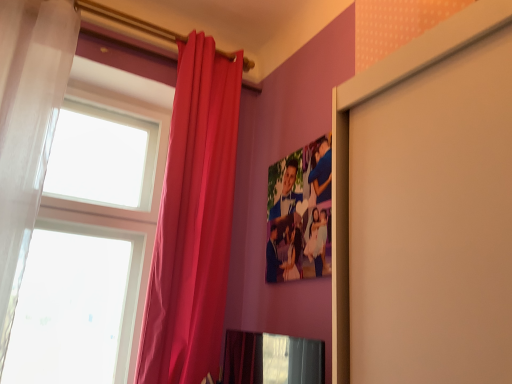
Question: Are sheer white curtain at left, arranged as the 2th curtain when viewed from the right, and matte pink curtain at upper left, which is the first curtain from right to left, far apart?

Choices:
 (A) yes
 (B) no

Answer: (B)

Question: From a real-world perspective, does sheer white curtain at left, which ranks as the 1th curtain in left-to-right order, stand above matte pink curtain at upper left, which is the first curtain from right to left?

Choices:
 (A) yes
 (B) no

Answer: (A)

Question: Would you say sheer white curtain at left, arranged as the 2th curtain when viewed from the right, is outside matte pink curtain at upper left, which is the first curtain from right to left?

Choices:
 (A) yes
 (B) no

Answer: (A)

Question: Is the surface of sheer white curtain at left, which ranks as the 1th curtain in left-to-right order, in direct contact with matte pink curtain at upper left, which is the first curtain from right to left?

Choices:
 (A) yes
 (B) no

Answer: (B)

Question: Is sheer white curtain at left, arranged as the 2th curtain when viewed from the right, further to camera compared to matte pink curtain at upper left, which ranks as the 2th curtain in left-to-right order?

Choices:
 (A) yes
 (B) no

Answer: (B)

Question: From the image's perspective, is sheer white curtain at left, arranged as the 2th curtain when viewed from the right, on matte pink curtain at upper left, which ranks as the 2th curtain in left-to-right order?

Choices:
 (A) yes
 (B) no

Answer: (A)

Question: Can you confirm if matte pink curtain at upper left, which ranks as the 2th curtain in left-to-right order, is positioned to the left of sheer white curtain at left, which ranks as the 1th curtain in left-to-right order?

Choices:
 (A) no
 (B) yes

Answer: (A)

Question: Considering the relative sizes of matte pink curtain at upper left, which is the first curtain from right to left, and sheer white curtain at left, which ranks as the 1th curtain in left-to-right order, in the image provided, is matte pink curtain at upper left, which is the first curtain from right to left, smaller than sheer white curtain at left, which ranks as the 1th curtain in left-to-right order,?

Choices:
 (A) yes
 (B) no

Answer: (B)

Question: Is matte pink curtain at upper left, which is the first curtain from right to left, turned away from sheer white curtain at left, which ranks as the 1th curtain in left-to-right order?

Choices:
 (A) yes
 (B) no

Answer: (B)

Question: From the image's perspective, is matte pink curtain at upper left, which ranks as the 2th curtain in left-to-right order, under sheer white curtain at left, arranged as the 2th curtain when viewed from the right?

Choices:
 (A) yes
 (B) no

Answer: (A)

Question: Does matte pink curtain at upper left, which ranks as the 2th curtain in left-to-right order, appear on the right side of sheer white curtain at left, which ranks as the 1th curtain in left-to-right order?

Choices:
 (A) yes
 (B) no

Answer: (A)

Question: Considering the relative sizes of matte pink curtain at upper left, which is the first curtain from right to left, and sheer white curtain at left, arranged as the 2th curtain when viewed from the right, in the image provided, is matte pink curtain at upper left, which is the first curtain from right to left, thinner than sheer white curtain at left, arranged as the 2th curtain when viewed from the right,?

Choices:
 (A) no
 (B) yes

Answer: (B)

Question: Is matte pink curtain at upper left, which ranks as the 2th curtain in left-to-right order, in front of or behind sheer white curtain at left, which ranks as the 1th curtain in left-to-right order, in the image?

Choices:
 (A) behind
 (B) front

Answer: (A)